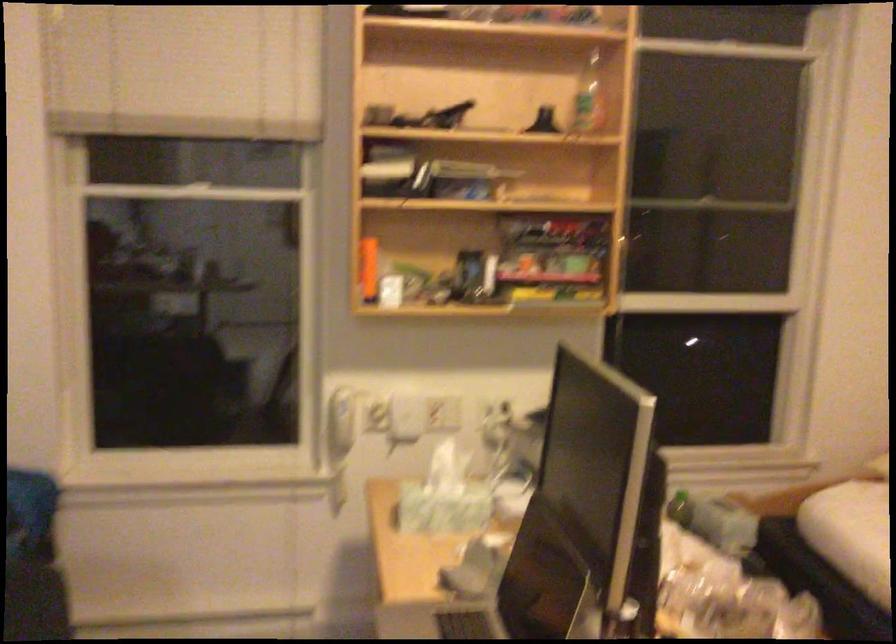
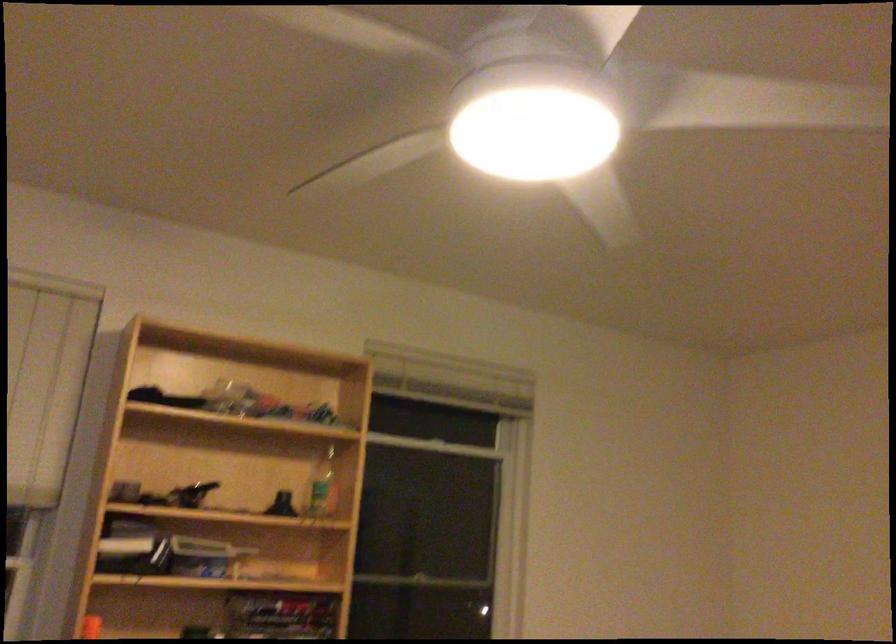
Locate, in the second image, the point that corresponds to pixel 371 240 in the first image.

(90, 627)